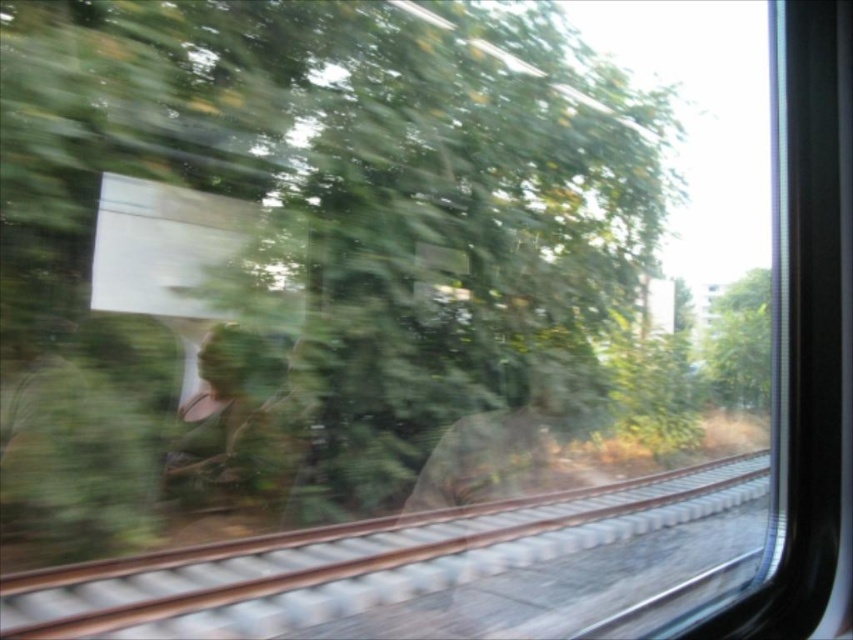
Question: Which point is closer to the camera taking this photo?

Choices:
 (A) (494, 536)
 (B) (740, 406)

Answer: (A)

Question: Considering the relative positions of brown metal track at lower center and green leafy tree at right in the image provided, where is brown metal track at lower center located with respect to green leafy tree at right?

Choices:
 (A) below
 (B) above

Answer: (A)

Question: From the image, what is the correct spatial relationship of brown metal track at lower center in relation to green leafy tree at right?

Choices:
 (A) right
 (B) left

Answer: (B)

Question: Which object is farther from the camera taking this photo?

Choices:
 (A) green leafy tree at right
 (B) brown metal track at lower center

Answer: (A)

Question: In this image, where is brown metal track at lower center located relative to green leafy tree at right?

Choices:
 (A) below
 (B) above

Answer: (A)